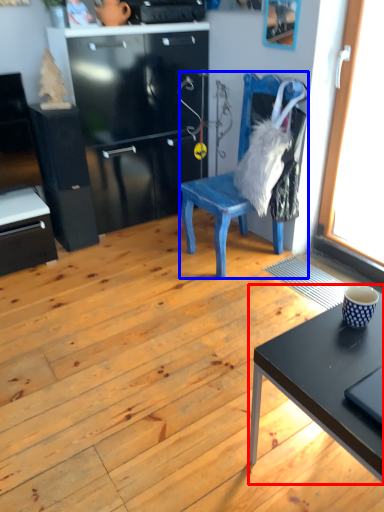
Question: Which point is closer to the camera, desk (highlighted by a red box) or chair (highlighted by a blue box)?

Choices:
 (A) desk
 (B) chair

Answer: (A)